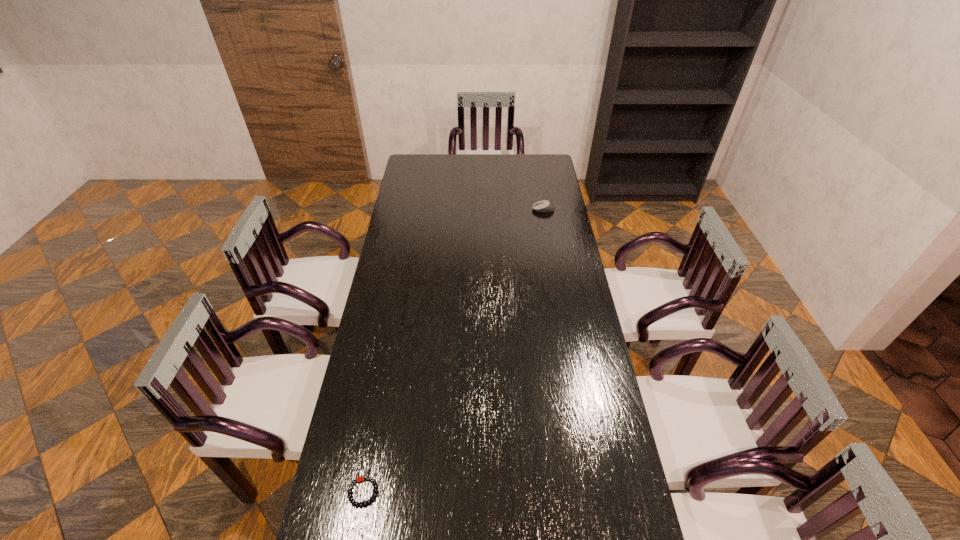
Image resolution: width=960 pixels, height=540 pixels. What are the coordinates of `the taller object` in the screenshot? It's located at (541, 206).

Locate an element on the screen. Image resolution: width=960 pixels, height=540 pixels. the right object is located at coordinates (541, 206).

Where is `the left object`? The image size is (960, 540). the left object is located at coordinates (361, 478).

Find the location of a particular element. the shorter object is located at coordinates (361, 478).

Locate an element on the screen. The image size is (960, 540). vacant space located on the wheel side of the right object is located at coordinates (461, 210).

The height and width of the screenshot is (540, 960). In order to click on free space located 0.210m on the wheel side of the right object in this screenshot , I will do `click(490, 210)`.

Find the location of a particular element. This screenshot has width=960, height=540. free location located 0.200m on the wheel side of the right object is located at coordinates (492, 210).

Where is `vacant space located 0.390m on the right of the bracelet`? vacant space located 0.390m on the right of the bracelet is located at coordinates point(519,492).

The width and height of the screenshot is (960, 540). Find the location of `object that is at the left edge`. object that is at the left edge is located at coordinates (361, 478).

Locate an element on the screen. The height and width of the screenshot is (540, 960). object located in the right edge section of the desktop is located at coordinates (541, 206).